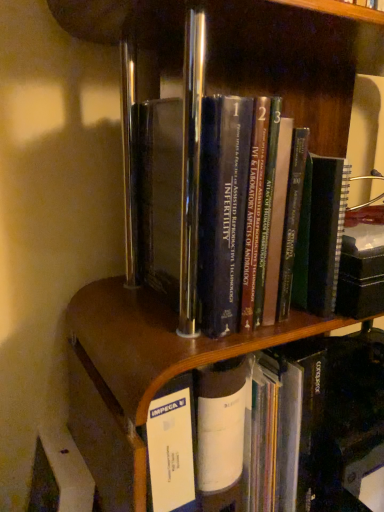
Based on the photo, in order to face hardcover books at center, the second book in the bottom-to-top sequence, should I rotate leftwards or rightwards?

You should look right and rotate roughly 4.168 degrees.

This screenshot has width=384, height=512. Identify the location of hardcover books at center, the second book in the bottom-to-top sequence. (160, 196).

Describe the element at coordinates (160, 196) in the screenshot. I see `hardcover books at center, the second book in the bottom-to-top sequence` at that location.

At what (x,y) coordinates should I click in order to perform the action: click on hardcover book at center, acting as the 2th book starting from the top. Please return your answer as a coordinate pair (x, y). Looking at the image, I should click on (329, 418).

This screenshot has height=512, width=384. Describe the element at coordinates (329, 418) in the screenshot. I see `hardcover book at center, acting as the 2th book starting from the top` at that location.

At what (x,y) coordinates should I click in order to perform the action: click on hardcover books at center, the second book in the bottom-to-top sequence. Please return your answer as a coordinate pair (x, y). Looking at the image, I should click on (160, 196).

Does hardcover book at center, acting as the 2th book starting from the top, appear on the right side of hardcover books at center, placed as the 1th book when sorted from top to bottom?

Correct, you'll find hardcover book at center, acting as the 2th book starting from the top, to the right of hardcover books at center, placed as the 1th book when sorted from top to bottom.

Considering their positions, is hardcover book at center, acting as the 2th book starting from the top, located in front of or behind hardcover books at center, placed as the 1th book when sorted from top to bottom?

hardcover book at center, acting as the 2th book starting from the top, is behind hardcover books at center, placed as the 1th book when sorted from top to bottom.

Is point (379, 409) closer or farther from the camera than point (164, 149)?

Point (379, 409) appears to be farther away from the viewer than point (164, 149).

From the image's perspective, is hardcover book at center, acting as the 2th book starting from the top, above or below hardcover books at center, the second book in the bottom-to-top sequence?

hardcover book at center, acting as the 2th book starting from the top, is situated lower than hardcover books at center, the second book in the bottom-to-top sequence, in the image.

From a real-world perspective, is hardcover book at center, acting as the 2th book starting from the top, on top of hardcover books at center, placed as the 1th book when sorted from top to bottom?

Incorrect, from a real-world perspective, hardcover book at center, acting as the 2th book starting from the top, is lower than hardcover books at center, placed as the 1th book when sorted from top to bottom.

Is hardcover book at center, acting as the first book starting from the bottom, wider or thinner than hardcover books at center, the second book in the bottom-to-top sequence?

hardcover book at center, acting as the first book starting from the bottom, is wider than hardcover books at center, the second book in the bottom-to-top sequence.

Considering the relative sizes of hardcover book at center, acting as the first book starting from the bottom, and hardcover books at center, placed as the 1th book when sorted from top to bottom, in the image provided, is hardcover book at center, acting as the first book starting from the bottom, shorter than hardcover books at center, placed as the 1th book when sorted from top to bottom,?

Yes.

Can you confirm if hardcover book at center, acting as the 2th book starting from the top, is smaller than hardcover books at center, the second book in the bottom-to-top sequence?

No, hardcover book at center, acting as the 2th book starting from the top, is not smaller than hardcover books at center, the second book in the bottom-to-top sequence.

Is hardcover book at center, acting as the first book starting from the bottom, not within hardcover books at center, the second book in the bottom-to-top sequence?

Absolutely, hardcover book at center, acting as the first book starting from the bottom, is external to hardcover books at center, the second book in the bottom-to-top sequence.

Is hardcover book at center, acting as the 2th book starting from the top, not near hardcover books at center, placed as the 1th book when sorted from top to bottom?

hardcover book at center, acting as the 2th book starting from the top, is near hardcover books at center, placed as the 1th book when sorted from top to bottom, not far away.

Is hardcover book at center, acting as the 2th book starting from the top, aimed at hardcover books at center, placed as the 1th book when sorted from top to bottom?

No, hardcover book at center, acting as the 2th book starting from the top, does not turn towards hardcover books at center, placed as the 1th book when sorted from top to bottom.

How far apart are hardcover book at center, acting as the first book starting from the bottom, and hardcover books at center, the second book in the bottom-to-top sequence?

The distance of hardcover book at center, acting as the first book starting from the bottom, from hardcover books at center, the second book in the bottom-to-top sequence, is 13.01 inches.

Image resolution: width=384 pixels, height=512 pixels. What are the coordinates of `book on the right of hardcover books at center, the second book in the bottom-to-top sequence` in the screenshot? It's located at (329, 418).

Considering the positions of objects hardcover books at center, the second book in the bottom-to-top sequence, and hardcover book at center, acting as the first book starting from the bottom, in the image provided, who is more to the right, hardcover books at center, the second book in the bottom-to-top sequence, or hardcover book at center, acting as the first book starting from the bottom,?

hardcover book at center, acting as the first book starting from the bottom, is more to the right.

Based on the photo, is hardcover books at center, placed as the 1th book when sorted from top to bottom, in front of hardcover book at center, acting as the 2th book starting from the top?

Yes, hardcover books at center, placed as the 1th book when sorted from top to bottom, is in front of hardcover book at center, acting as the 2th book starting from the top.

Does point (203, 152) come farther from viewer compared to point (327, 487)?

No, it is not.

From the image's perspective, is hardcover books at center, the second book in the bottom-to-top sequence, above or below hardcover book at center, acting as the 2th book starting from the top?

From the image's perspective, hardcover books at center, the second book in the bottom-to-top sequence, appears above hardcover book at center, acting as the 2th book starting from the top.

From a real-world perspective, between hardcover books at center, placed as the 1th book when sorted from top to bottom, and hardcover book at center, acting as the first book starting from the bottom, who is vertically higher?

From a 3D spatial view, hardcover books at center, placed as the 1th book when sorted from top to bottom, is above.

Considering the relative sizes of hardcover books at center, the second book in the bottom-to-top sequence, and hardcover book at center, acting as the first book starting from the bottom, in the image provided, is hardcover books at center, the second book in the bottom-to-top sequence, thinner than hardcover book at center, acting as the first book starting from the bottom,?

Yes, hardcover books at center, the second book in the bottom-to-top sequence, is thinner than hardcover book at center, acting as the first book starting from the bottom.

Does hardcover books at center, the second book in the bottom-to-top sequence, have a lesser height compared to hardcover book at center, acting as the first book starting from the bottom?

No, hardcover books at center, the second book in the bottom-to-top sequence, is not shorter than hardcover book at center, acting as the first book starting from the bottom.

Between hardcover books at center, the second book in the bottom-to-top sequence, and hardcover book at center, acting as the 2th book starting from the top, which one has larger size?

Bigger between the two is hardcover book at center, acting as the 2th book starting from the top.

Could hardcover book at center, acting as the first book starting from the bottom, be considered to be inside hardcover books at center, placed as the 1th book when sorted from top to bottom?

No, hardcover book at center, acting as the first book starting from the bottom, is not inside hardcover books at center, placed as the 1th book when sorted from top to bottom.

Is hardcover books at center, placed as the 1th book when sorted from top to bottom, directly adjacent to hardcover book at center, acting as the first book starting from the bottom?

No, hardcover books at center, placed as the 1th book when sorted from top to bottom, is not making contact with hardcover book at center, acting as the first book starting from the bottom.

Could you tell me if hardcover books at center, placed as the 1th book when sorted from top to bottom, is turned towards hardcover book at center, acting as the 2th book starting from the top?

No, hardcover books at center, placed as the 1th book when sorted from top to bottom, is not oriented towards hardcover book at center, acting as the 2th book starting from the top.

Measure the distance between hardcover books at center, the second book in the bottom-to-top sequence, and hardcover book at center, acting as the 2th book starting from the top.

hardcover books at center, the second book in the bottom-to-top sequence, is 33.05 centimeters from hardcover book at center, acting as the 2th book starting from the top.

Find the location of a particular element. The width and height of the screenshot is (384, 512). book that appears above the hardcover book at center, acting as the first book starting from the bottom (from the image's perspective) is located at coordinates (160, 196).

I want to click on book above the hardcover book at center, acting as the 2th book starting from the top (from the image's perspective), so click(x=160, y=196).

The height and width of the screenshot is (512, 384). Identify the location of book on the right of hardcover books at center, the second book in the bottom-to-top sequence. (329, 418).